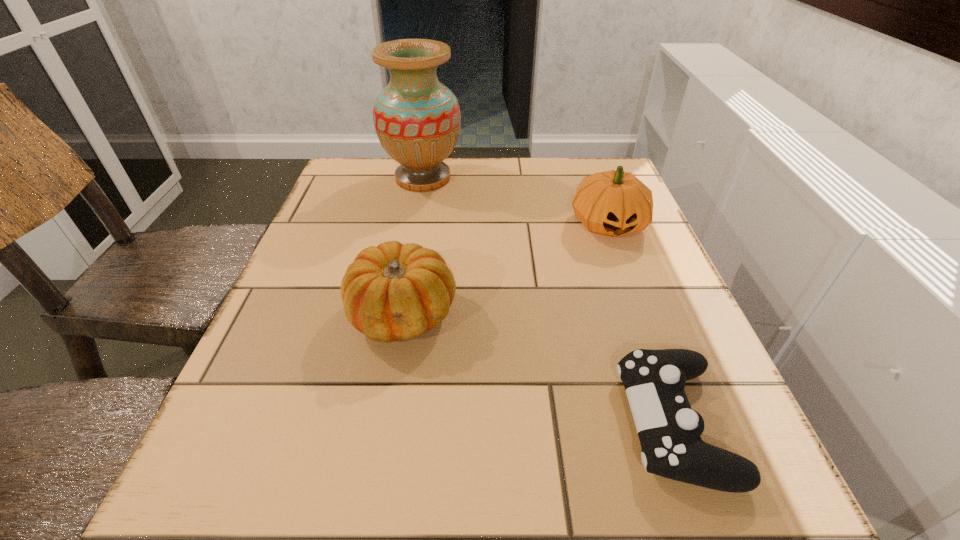
The height and width of the screenshot is (540, 960). Find the location of `the farthest object`. the farthest object is located at coordinates (417, 119).

This screenshot has width=960, height=540. In order to click on vase in this screenshot , I will do `click(417, 119)`.

Locate an element on the screen. This screenshot has height=540, width=960. the right gourd is located at coordinates click(613, 203).

Identify the location of the second tallest object. The width and height of the screenshot is (960, 540). (613, 203).

The height and width of the screenshot is (540, 960). Find the location of `the nearer gourd`. the nearer gourd is located at coordinates (391, 292).

This screenshot has height=540, width=960. In order to click on the left gourd in this screenshot , I will do `click(391, 292)`.

Where is `control`? This screenshot has width=960, height=540. control is located at coordinates (669, 430).

The width and height of the screenshot is (960, 540). Find the location of `the nearest object`. the nearest object is located at coordinates (669, 430).

The image size is (960, 540). Find the location of `free spot located on the front of the vase`. free spot located on the front of the vase is located at coordinates (407, 261).

The image size is (960, 540). Find the location of `free region located on the side of the third shortest object with the carved face`. free region located on the side of the third shortest object with the carved face is located at coordinates (667, 382).